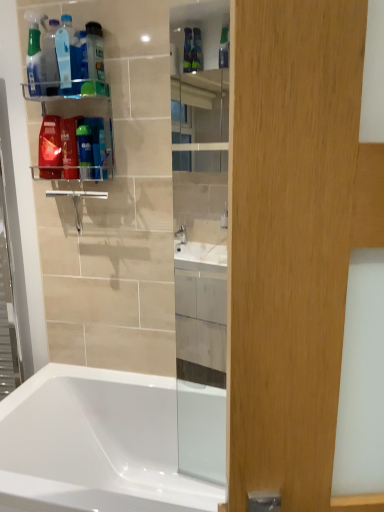
The width and height of the screenshot is (384, 512). Describe the element at coordinates (201, 238) in the screenshot. I see `transparent glass mirror at center` at that location.

The width and height of the screenshot is (384, 512). I want to click on translucent plastic spray bottle at upper left, positioned as the 1th cleaning product in left-to-right order, so click(x=35, y=55).

Describe the element at coordinates (68, 57) in the screenshot. This screenshot has height=512, width=384. I see `translucent plastic bottle at upper left, the 2th cleaning product when ordered from left to right` at that location.

In order to face translucent plastic bottle at upper left, placed as the 3th cleaning product when sorted from left to right, should I rotate leftwards or rightwards?

Rotate left and turn 12.654 degrees.

Locate an element on the screen. translucent plastic bottle at upper left, which is the 1th cleaning product from right to left is located at coordinates (95, 51).

This screenshot has height=512, width=384. Identify the location of clear plastic shelf at upper left. (79, 110).

Identify the location of transparent glass mirror at center. The image size is (384, 512). [x=201, y=238].

Which is closer to the camera, (47, 162) or (54, 27)?

Point (47, 162) appears to be farther away from the viewer than point (54, 27).

Is red glossy mouthwash at left taller or shorter than translucent plastic bottle at upper left?

Clearly, red glossy mouthwash at left is shorter compared to translucent plastic bottle at upper left.

Looking at the image, does red glossy mouthwash at left seem bigger or smaller compared to translucent plastic bottle at upper left?

Considering their sizes, red glossy mouthwash at left takes up more space than translucent plastic bottle at upper left.

Considering their positions, is red glossy mouthwash at left located in front of or behind translucent plastic bottle at upper left?

In the image, red glossy mouthwash at left appears behind translucent plastic bottle at upper left.

What's the angular difference between translucent plastic shaving cream at upper left and translucent plastic bottle at upper left, the 2th cleaning product when ordered from left to right,'s facing directions?

0.00381 degrees.

Which is in front, translucent plastic shaving cream at upper left or translucent plastic bottle at upper left, placed as the 2th cleaning product when sorted from right to left?

translucent plastic bottle at upper left, placed as the 2th cleaning product when sorted from right to left.

Looking at this image, would you say translucent plastic bottle at upper left, placed as the 2th cleaning product when sorted from right to left, is part of translucent plastic shaving cream at upper left's contents?

Actually, translucent plastic bottle at upper left, placed as the 2th cleaning product when sorted from right to left, is outside translucent plastic shaving cream at upper left.

Is translucent plastic bottle at upper left, placed as the 3th cleaning product when sorted from left to right, to the left of transparent glass mirror at center from the viewer's perspective?

Yes.

From the image's perspective, is translucent plastic bottle at upper left, which is the 1th cleaning product from right to left, located above or below transparent glass mirror at center?

translucent plastic bottle at upper left, which is the 1th cleaning product from right to left, is situated higher than transparent glass mirror at center in the image.

Is translucent plastic bottle at upper left, placed as the 3th cleaning product when sorted from left to right, taller or shorter than transparent glass mirror at center?

translucent plastic bottle at upper left, placed as the 3th cleaning product when sorted from left to right, is shorter than transparent glass mirror at center.

In terms of width, does translucent plastic bottle at upper left, which is the 1th cleaning product from right to left, look wider or thinner when compared to transparent glass mirror at center?

Clearly, translucent plastic bottle at upper left, which is the 1th cleaning product from right to left, has more width compared to transparent glass mirror at center.

Is clear plastic shelf at upper left in contact with translucent plastic bottle at upper left, the 2th cleaning product when ordered from left to right?

clear plastic shelf at upper left is not next to translucent plastic bottle at upper left, the 2th cleaning product when ordered from left to right, and they're not touching.

From the image's perspective, is clear plastic shelf at upper left above translucent plastic bottle at upper left, the 2th cleaning product when ordered from left to right?

No, from the image's perspective, clear plastic shelf at upper left is not on top of translucent plastic bottle at upper left, the 2th cleaning product when ordered from left to right.

Locate an element on the screen. Image resolution: width=384 pixels, height=512 pixels. cabinet below the translucent plastic bottle at upper left, the 2th cleaning product when ordered from left to right (from a real-world perspective) is located at coordinates (79, 110).

From a real-world perspective, is red glossy mouthwash at left above or below translucent plastic spray bottle at upper left, positioned as the 1th cleaning product in left-to-right order?

red glossy mouthwash at left is below translucent plastic spray bottle at upper left, positioned as the 1th cleaning product in left-to-right order.

Can you tell me how much red glossy mouthwash at left and translucent plastic spray bottle at upper left, which is the third cleaning product in right-to-left order, differ in facing direction?

red glossy mouthwash at left and translucent plastic spray bottle at upper left, which is the third cleaning product in right-to-left order, are facing 0.000441 degrees away from each other.

Is red glossy mouthwash at left at the right side of translucent plastic spray bottle at upper left, which is the third cleaning product in right-to-left order?

Correct, you'll find red glossy mouthwash at left to the right of translucent plastic spray bottle at upper left, which is the third cleaning product in right-to-left order.

Identify the location of cleaning product that is the 3rd object above the red glossy mouthwash at left (from a real-world perspective). (35, 55).

Considering the relative sizes of transparent glass mirror at center and white glossy bathtub at lower left in the image provided, is transparent glass mirror at center taller than white glossy bathtub at lower left?

Yes.

Is transparent glass mirror at center positioned far away from white glossy bathtub at lower left?

No, transparent glass mirror at center is not far away from white glossy bathtub at lower left.

Is transparent glass mirror at center wider than white glossy bathtub at lower left?

Incorrect, the width of transparent glass mirror at center does not surpass that of white glossy bathtub at lower left.

Would you say transparent glass mirror at center is to the left or to the right of white glossy bathtub at lower left in the picture?

transparent glass mirror at center is positioned on white glossy bathtub at lower left's right side.

Does translucent plastic bottle at upper left, placed as the 2th cleaning product when sorted from right to left, have a greater height compared to translucent plastic spray bottle at upper left, positioned as the 1th cleaning product in left-to-right order?

Incorrect, the height of translucent plastic bottle at upper left, placed as the 2th cleaning product when sorted from right to left, is not larger of that of translucent plastic spray bottle at upper left, positioned as the 1th cleaning product in left-to-right order.

From a real-world perspective, is translucent plastic bottle at upper left, placed as the 2th cleaning product when sorted from right to left, below translucent plastic spray bottle at upper left, positioned as the 1th cleaning product in left-to-right order?

Yes.

Is translucent plastic bottle at upper left, placed as the 2th cleaning product when sorted from right to left, facing towards translucent plastic spray bottle at upper left, which is the third cleaning product in right-to-left order?

No, translucent plastic bottle at upper left, placed as the 2th cleaning product when sorted from right to left, is not turned towards translucent plastic spray bottle at upper left, which is the third cleaning product in right-to-left order.

Locate an element on the screen. mouthwash that is on the left side of translucent plastic bottle at upper left is located at coordinates (50, 147).

I want to click on toiletry below the translucent plastic bottle at upper left, placed as the 2th cleaning product when sorted from right to left (from the image's perspective), so click(85, 151).

Consider the image. Considering their positions, is translucent plastic spray bottle at upper left, positioned as the 1th cleaning product in left-to-right order, positioned further to red glossy mouthwash at left than translucent plastic bottle at upper left?

translucent plastic spray bottle at upper left, positioned as the 1th cleaning product in left-to-right order.

Looking at the image, which one is located further to translucent plastic bottle at upper left, the 2th cleaning product when ordered from left to right, clear plastic shelf at upper left or red glossy mouthwash at left?

red glossy mouthwash at left is positioned further to the anchor translucent plastic bottle at upper left, the 2th cleaning product when ordered from left to right.

Based on their spatial positions, is translucent plastic bottle at upper left, the 2th cleaning product when ordered from left to right, or transparent glass mirror at center further from white glossy bathtub at lower left?

Based on the image, translucent plastic bottle at upper left, the 2th cleaning product when ordered from left to right, appears to be further to white glossy bathtub at lower left.

Looking at the image, which one is located further to translucent plastic spray bottle at upper left, positioned as the 1th cleaning product in left-to-right order, transparent glass mirror at center or translucent plastic bottle at upper left?

transparent glass mirror at center lies further to translucent plastic spray bottle at upper left, positioned as the 1th cleaning product in left-to-right order, than the other object.

Based on the photo, from the image, which object appears to be nearer to translucent plastic bottle at upper left, placed as the 2th cleaning product when sorted from right to left, clear plastic shelf at upper left or transparent glass mirror at center?

The object closer to translucent plastic bottle at upper left, placed as the 2th cleaning product when sorted from right to left, is clear plastic shelf at upper left.

Considering their positions, is translucent plastic shaving cream at upper left positioned further to translucent plastic bottle at upper left, placed as the 2th cleaning product when sorted from right to left, than clear plastic shelf at upper left?

translucent plastic shaving cream at upper left.

Based on their spatial positions, is translucent plastic shaving cream at upper left or transparent glass mirror at center further from translucent plastic bottle at upper left, placed as the 3th cleaning product when sorted from left to right?

Among the two, transparent glass mirror at center is located further to translucent plastic bottle at upper left, placed as the 3th cleaning product when sorted from left to right.

When comparing their distances from red glossy mouthwash at left, does translucent plastic bottle at upper left, placed as the 3th cleaning product when sorted from left to right, or white glossy bathtub at lower left seem closer?

Among the two, translucent plastic bottle at upper left, placed as the 3th cleaning product when sorted from left to right, is located nearer to red glossy mouthwash at left.

Where is `toiletry between translucent plastic spray bottle at upper left, positioned as the 1th cleaning product in left-to-right order, and white glossy bathtub at lower left vertically`? The height and width of the screenshot is (512, 384). toiletry between translucent plastic spray bottle at upper left, positioned as the 1th cleaning product in left-to-right order, and white glossy bathtub at lower left vertically is located at coordinates (85, 151).

At what (x,y) coordinates should I click in order to perform the action: click on toiletry between translucent plastic bottle at upper left, which is the 1th cleaning product from right to left, and white glossy bathtub at lower left in the up-down direction. Please return your answer as a coordinate pair (x, y). The width and height of the screenshot is (384, 512). Looking at the image, I should click on (85, 151).

Find the location of `mirror between red glossy mouthwash at left and white glossy bathtub at lower left in the vertical direction`. mirror between red glossy mouthwash at left and white glossy bathtub at lower left in the vertical direction is located at coordinates (201, 238).

The width and height of the screenshot is (384, 512). I want to click on mirror between translucent plastic bottle at upper left, the 2th cleaning product when ordered from left to right, and white glossy bathtub at lower left from top to bottom, so click(x=201, y=238).